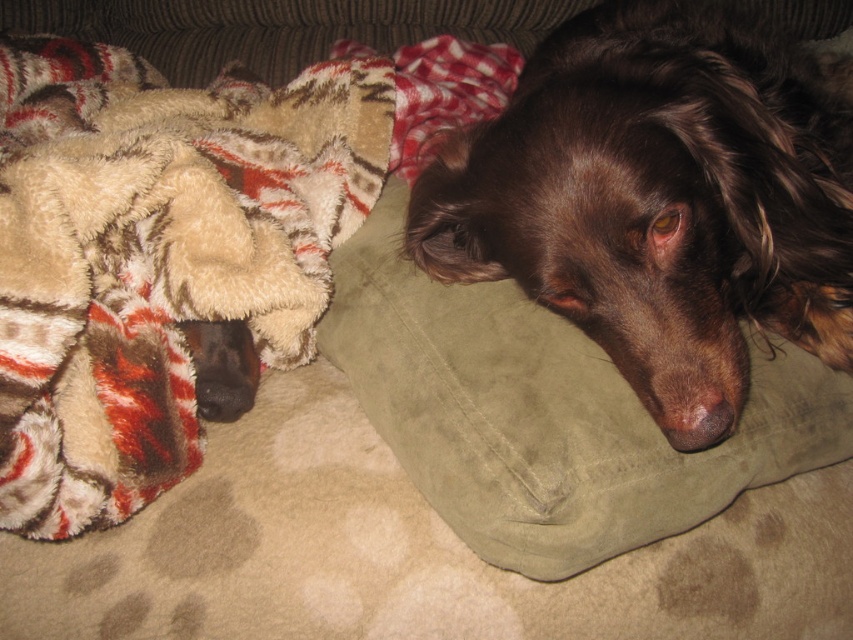
Question: Which object appears farthest from the camera in this image?

Choices:
 (A) fuzzy beige blanket at left
 (B) suede pillow at center
 (C) brown velvet dog at center

Answer: (C)

Question: Where is fuzzy beige blanket at left located in relation to brown velvet dog at center in the image?

Choices:
 (A) right
 (B) left

Answer: (B)

Question: Which point is farther to the camera?

Choices:
 (A) suede pillow at center
 (B) fuzzy beige blanket at left
 (C) brown velvet dog at center

Answer: (C)

Question: Where is fuzzy beige blanket at left located in relation to brown velvet dog at center in the image?

Choices:
 (A) above
 (B) below

Answer: (B)

Question: Can you confirm if brown velvet dog at center is bigger than suede pillow at center?

Choices:
 (A) no
 (B) yes

Answer: (B)

Question: Which point is closer to the camera?

Choices:
 (A) (120, 65)
 (B) (502, 385)
 (C) (703, 147)

Answer: (B)